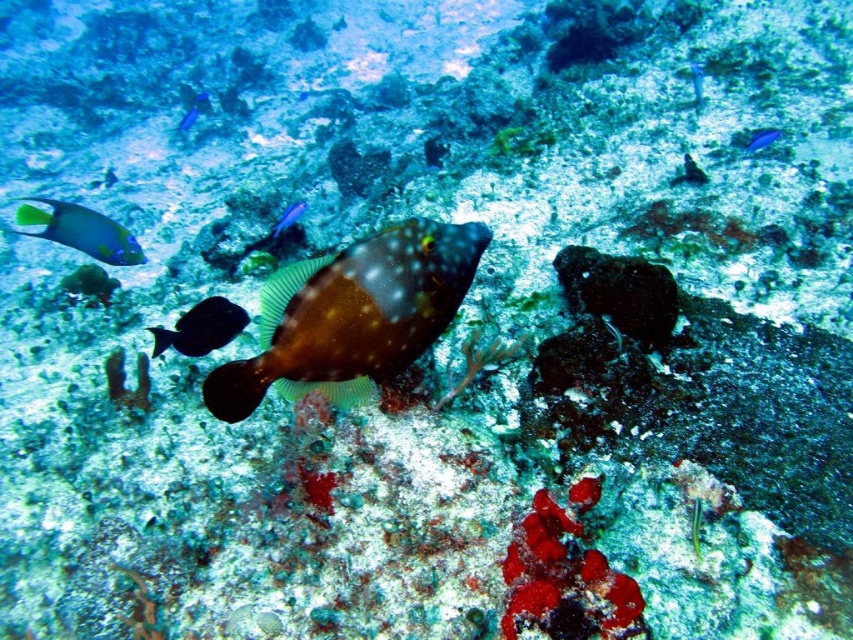
Question: Which of these objects is positioned closest to the blue glossy fish at upper right?

Choices:
 (A) shiny blue fish at upper left
 (B) green matte fish at upper left

Answer: (B)

Question: From the image, what is the correct spatial relationship of shiny black fish at center in relation to shiny green fish at center?

Choices:
 (A) below
 (B) above

Answer: (B)

Question: Is blue glossy fish at upper right positioned at the back of blue glossy fish at upper center?

Choices:
 (A) yes
 (B) no

Answer: (B)

Question: Which point appears closest to the camera in this image?

Choices:
 (A) (288, 353)
 (B) (289, 211)
 (C) (190, 349)

Answer: (A)

Question: Does green matte fish at upper left have a larger size compared to translucent blue fish at center?

Choices:
 (A) yes
 (B) no

Answer: (A)

Question: Which of the following is the closest to the observer?

Choices:
 (A) translucent blue fish at center
 (B) blue glossy fish at upper center
 (C) shiny green fish at center
 (D) blue glossy fish at upper right

Answer: (C)